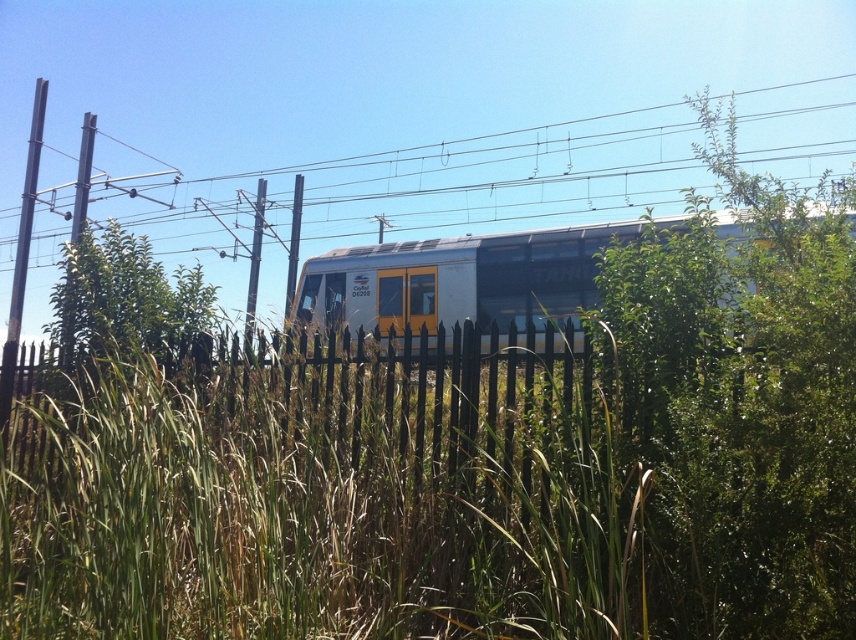
Does metallic wire at upper center lie behind green leafy tree at center?

Yes.

Between metallic wire at upper center and green leafy tree at center, which one has more height?

Standing taller between the two is metallic wire at upper center.

Locate an element on the screen. The image size is (856, 640). metallic wire at upper center is located at coordinates (440, 186).

Does silver metallic train at center appear under smooth metal pole at left?

Correct, silver metallic train at center is located below smooth metal pole at left.

At what (x,y) coordinates should I click in order to perform the action: click on silver metallic train at center. Please return your answer as a coordinate pair (x, y). The image size is (856, 640). Looking at the image, I should click on (459, 280).

Identify the location of silver metallic train at center. (459, 280).

Is point (497, 168) positioned in front of point (385, 416)?

No, (497, 168) is behind (385, 416).

Can you confirm if metallic wire at upper center is positioned below black metal fence at center?

No, metallic wire at upper center is not below black metal fence at center.

Is point (158, 184) less distant than point (292, 403)?

No, it is not.

This screenshot has width=856, height=640. I want to click on metallic wire at upper center, so click(440, 186).